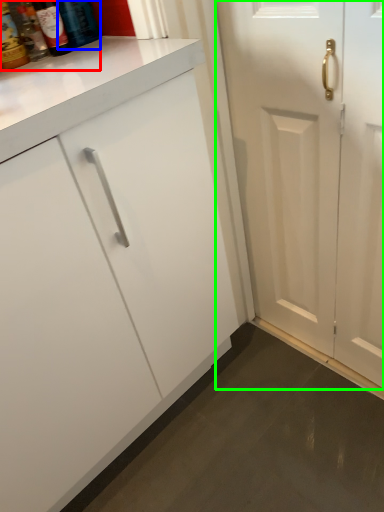
Question: Which object is the closest to the bottle (highlighted by a red box)? Choose among these: bottle (highlighted by a blue box) or door (highlighted by a green box).

Choices:
 (A) bottle
 (B) door

Answer: (A)